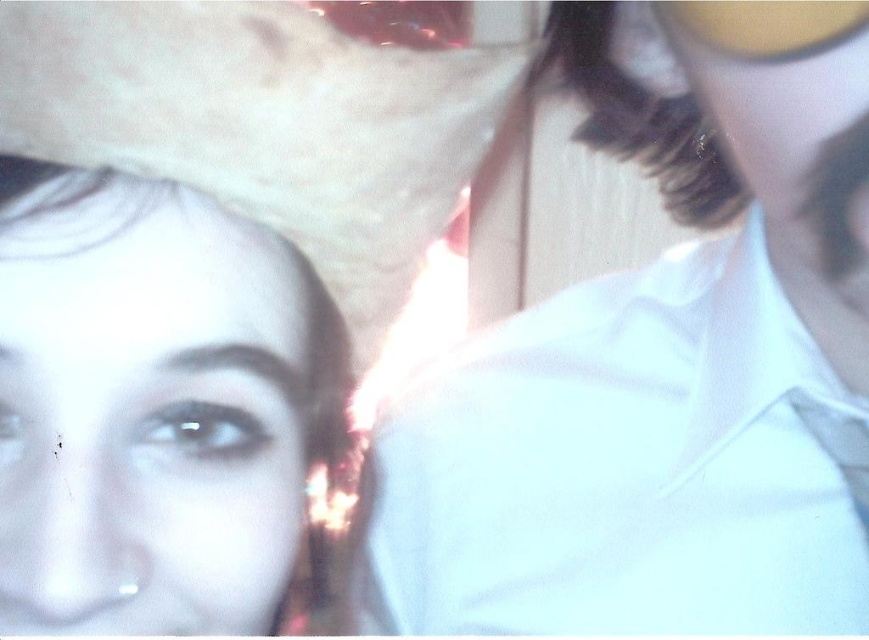
Question: Does white smooth shirt at upper right appear over smooth skin face at lower left?

Choices:
 (A) no
 (B) yes

Answer: (B)

Question: Can you confirm if white smooth shirt at upper right is positioned below smooth skin face at lower left?

Choices:
 (A) yes
 (B) no

Answer: (B)

Question: Which object is positioned farthest from the smooth skin face at lower left?

Choices:
 (A) white smooth shirt at upper right
 (B) white felt cowboy hat at upper left

Answer: (A)

Question: Which point appears farthest from the camera in this image?

Choices:
 (A) (63, 474)
 (B) (204, 88)

Answer: (A)

Question: Based on their relative distances, which object is nearer to the white smooth shirt at upper right?

Choices:
 (A) white felt cowboy hat at upper left
 (B) smooth skin face at lower left

Answer: (A)

Question: Can you confirm if white smooth shirt at upper right is positioned below smooth skin face at lower left?

Choices:
 (A) no
 (B) yes

Answer: (A)